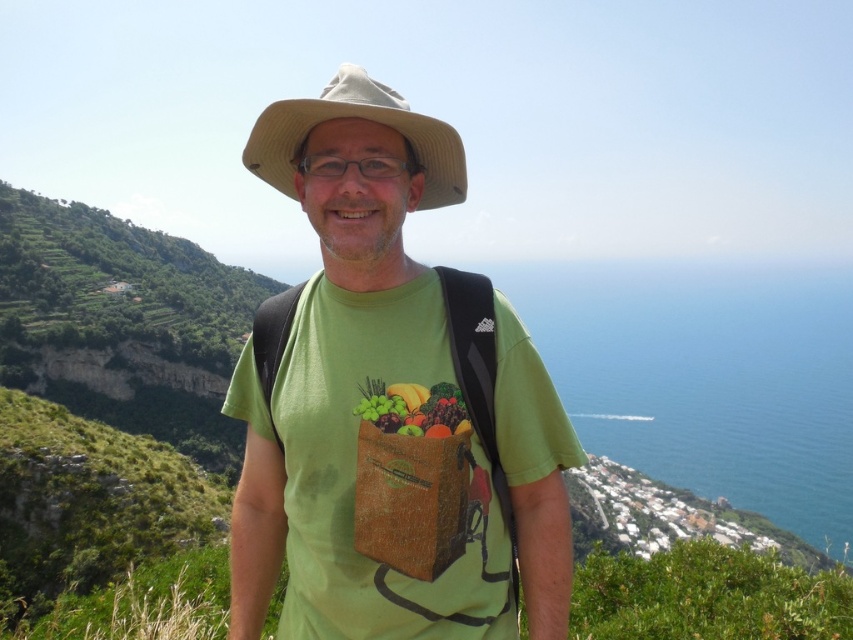
You are a photographer planning to take a portrait of the person wearing the beige fabric cowboy hat at center. If your camera has a maximum focus range of 60 feet, will you be able to capture a clear image of the hat?

The beige fabric cowboy hat at center is 61.21 feet from the camera, which exceeds the maximum focus range of 60 feet. Therefore, the camera cannot capture a clear image of the hat.